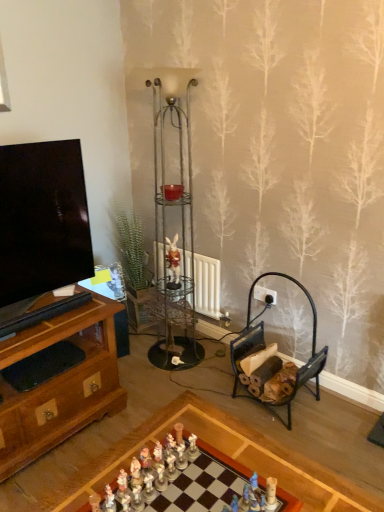
Question: Based on their positions, is white plastic power outlet at center-right located to the left or right of matte brown figurine at center?

Choices:
 (A) right
 (B) left

Answer: (A)

Question: Is white plastic power outlet at center-right taller or shorter than matte brown figurine at center?

Choices:
 (A) tall
 (B) short

Answer: (B)

Question: Which object is positioned farthest from the white porcelain figurines at center, placed as the 1th toy when sorted from back to front?

Choices:
 (A) wooden chessboard at center
 (B) white plastic power outlet at center-right
 (C) shiny silver chess piece at center, positioned as the 2th toy in front-to-back order
 (D) matte brown figurine at center
 (E) metallic wire shelving unit at center

Answer: (E)

Question: Which object is the closest to the white plastic power outlet at center-right?

Choices:
 (A) matte brown figurine at center
 (B) matte glass candle holder at center
 (C) matte blue figurine at center, which is counted as the third toy, starting from the left
 (D) white painted radiator at center
 (E) wooden chessboard at center

Answer: (D)